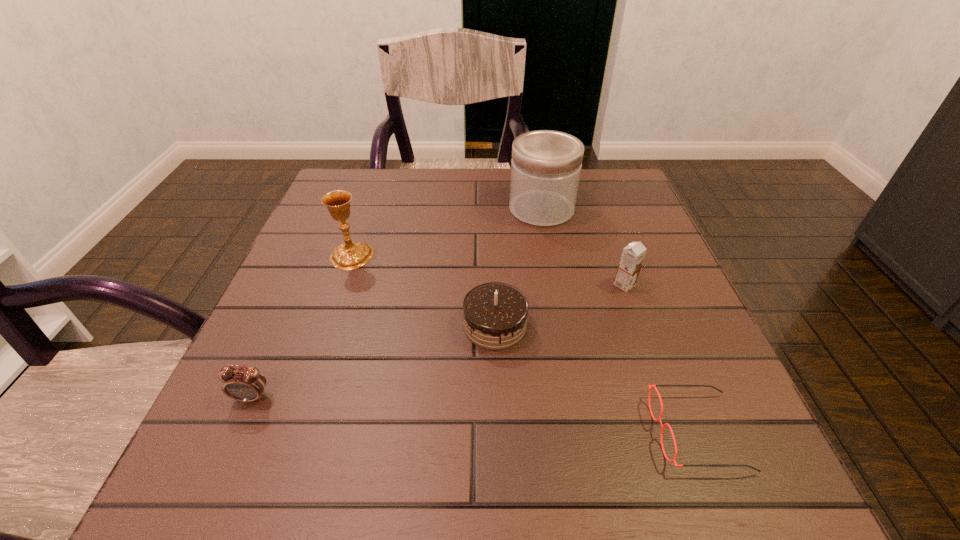
Image resolution: width=960 pixels, height=540 pixels. Identify the location of free space between the farthest object and the third farthest object. (583, 247).

At what (x,y) coordinates should I click in order to perform the action: click on empty location between the alarm clock and the spectacles. Please return your answer as a coordinate pair (x, y). The height and width of the screenshot is (540, 960). Looking at the image, I should click on (475, 415).

I want to click on free point between the farthest object and the shortest object, so click(x=619, y=321).

Locate an element on the screen. The width and height of the screenshot is (960, 540). vacant region between the second object from left to right and the chocolate cake is located at coordinates pos(423,291).

Where is `unoccupied position between the leftmost object and the chocolate milk`? This screenshot has width=960, height=540. unoccupied position between the leftmost object and the chocolate milk is located at coordinates (439, 341).

Locate an element on the screen. The height and width of the screenshot is (540, 960). vacant region between the leftmost object and the chalice is located at coordinates (301, 327).

The height and width of the screenshot is (540, 960). I want to click on free spot between the spectacles and the second object from left to right, so click(x=524, y=344).

Identify the location of object that is the second closest one to the spectacles. (632, 256).

Choose which object is the third nearest neighbor to the leftmost object. Please provide its 2D coordinates. Your answer should be formatted as a tuple, i.e. [(x, y)], where the tuple contains the x and y coordinates of a point satisfying the conditions above.

[(650, 388)]

Where is `free space that satisfies the following two spatial constraints: 1. on the front side of the third farthest object; 2. on the left side of the jar`? The height and width of the screenshot is (540, 960). free space that satisfies the following two spatial constraints: 1. on the front side of the third farthest object; 2. on the left side of the jar is located at coordinates (556, 285).